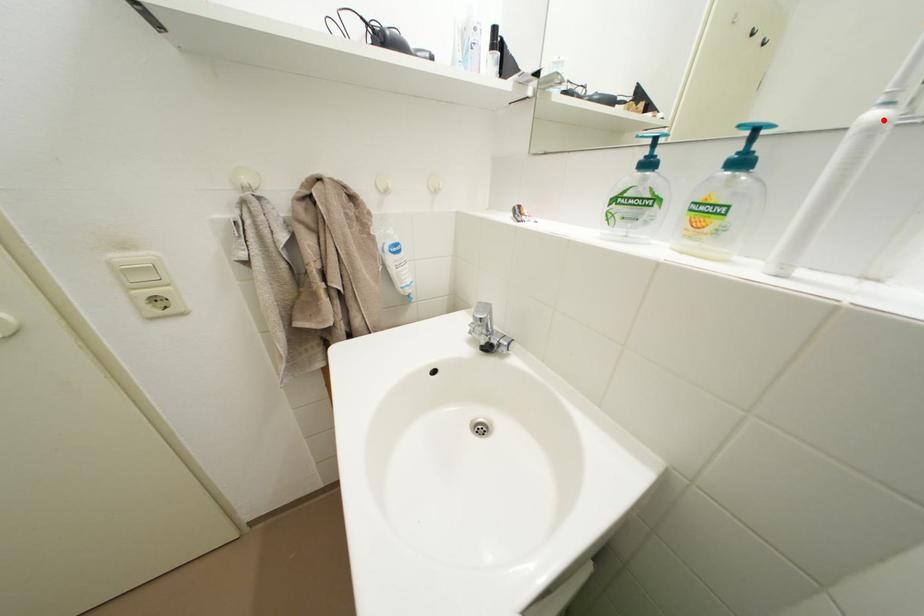
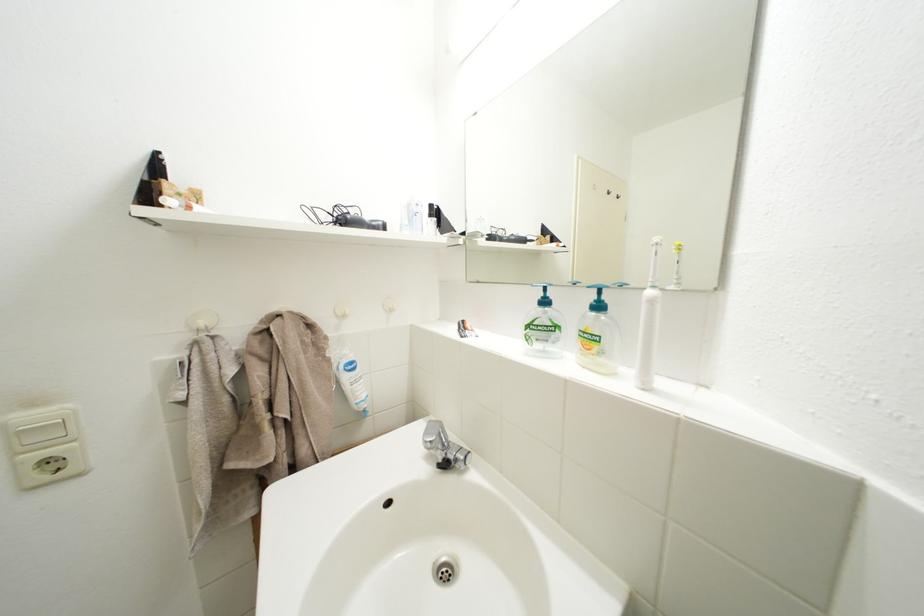
Question: I am providing you with two images of the same scene from different viewpoints. A red point is marked on the first image. Can you still see the location of the red point in image 2?

Choices:
 (A) Yes
 (B) No

Answer: (A)